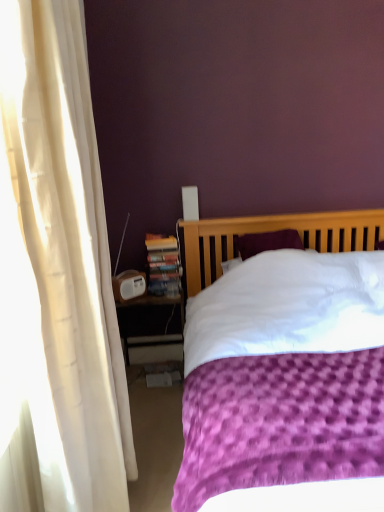
Question: Can you confirm if white plastic nightstand at lower left is wider than hardcover book at left?

Choices:
 (A) yes
 (B) no

Answer: (A)

Question: Does white plastic nightstand at lower left touch hardcover book at left?

Choices:
 (A) yes
 (B) no

Answer: (B)

Question: From a real-world perspective, is white plastic nightstand at lower left physically above hardcover book at left?

Choices:
 (A) no
 (B) yes

Answer: (A)

Question: Considering the relative sizes of white plastic nightstand at lower left and hardcover book at left in the image provided, is white plastic nightstand at lower left smaller than hardcover book at left?

Choices:
 (A) yes
 (B) no

Answer: (B)

Question: Is white plastic nightstand at lower left bigger than hardcover book at left?

Choices:
 (A) yes
 (B) no

Answer: (A)

Question: Is white plastic nightstand at lower left shorter than hardcover book at left?

Choices:
 (A) no
 (B) yes

Answer: (A)

Question: Is hardcover book at left positioned before white plastic nightstand at lower left?

Choices:
 (A) yes
 (B) no

Answer: (B)

Question: From the image's perspective, is hardcover book at left located beneath white plastic nightstand at lower left?

Choices:
 (A) no
 (B) yes

Answer: (A)

Question: Is hardcover book at left taller than white plastic nightstand at lower left?

Choices:
 (A) no
 (B) yes

Answer: (A)

Question: Considering the relative sizes of hardcover book at left and white plastic nightstand at lower left in the image provided, is hardcover book at left shorter than white plastic nightstand at lower left?

Choices:
 (A) yes
 (B) no

Answer: (A)

Question: From a real-world perspective, is hardcover book at left under white plastic nightstand at lower left?

Choices:
 (A) no
 (B) yes

Answer: (A)

Question: Is hardcover book at left to the left of white plastic nightstand at lower left from the viewer's perspective?

Choices:
 (A) yes
 (B) no

Answer: (B)

Question: Is purple textured bed at center wider than hardcover book at left?

Choices:
 (A) yes
 (B) no

Answer: (A)